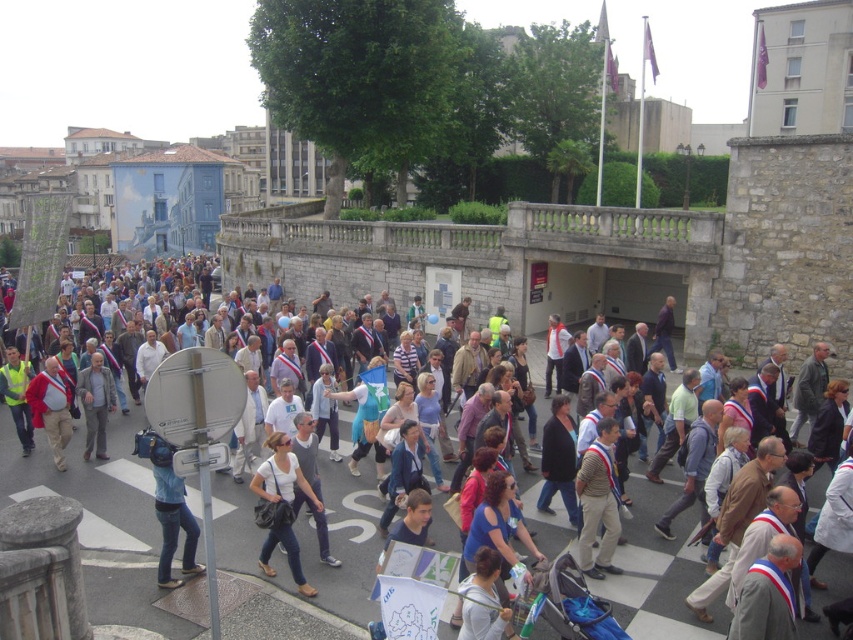
Can you confirm if white cotton shirt at center is taller than white matte shirt at center?

Correct, white cotton shirt at center is much taller as white matte shirt at center.

Locate an element on the screen. Image resolution: width=853 pixels, height=640 pixels. white cotton shirt at center is located at coordinates (91, 483).

Where is `white cotton shirt at center`? The image size is (853, 640). white cotton shirt at center is located at coordinates (91, 483).

Is white cotton shirt at center further to the viewer compared to blue denim jeans at center?

No.

Is white cotton shirt at center positioned in front of blue denim jeans at center?

Yes, white cotton shirt at center is in front of blue denim jeans at center.

Between point (839, 563) and point (165, 483), which one is positioned in front?

Point (165, 483)

Identify the location of white cotton shirt at center. The width and height of the screenshot is (853, 640). (91, 483).

Can you confirm if white cotton shirt at center is positioned to the right of red fabric coat at center?

Correct, you'll find white cotton shirt at center to the right of red fabric coat at center.

Who is positioned more to the right, white cotton shirt at center or red fabric coat at center?

From the viewer's perspective, white cotton shirt at center appears more on the right side.

Who is more forward, (572, 532) or (59, 392)?

Positioned in front is point (572, 532).

In order to click on white cotton shirt at center in this screenshot , I will do `click(91, 483)`.